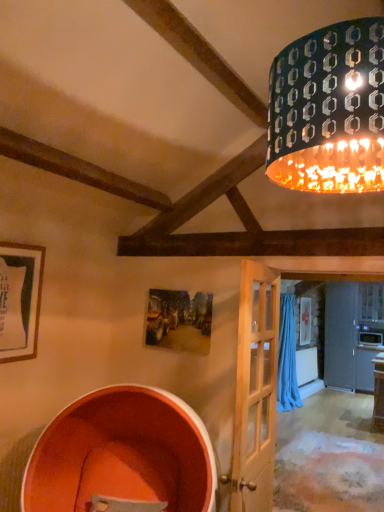
Find the location of a particular element. This screenshot has width=384, height=512. free point above matte black picture frame at left (from a real-world perspective) is located at coordinates (18, 244).